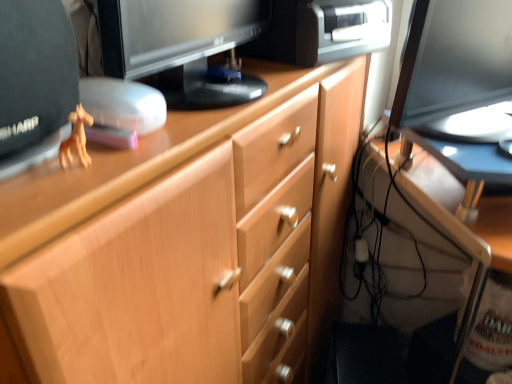
Image resolution: width=512 pixels, height=384 pixels. In order to click on satin black monitor at upper right in this screenshot , I will do `click(453, 59)`.

The height and width of the screenshot is (384, 512). What do you see at coordinates (453, 59) in the screenshot?
I see `satin black monitor at upper right` at bounding box center [453, 59].

The width and height of the screenshot is (512, 384). What are the coordinates of `satin black monitor at upper right` in the screenshot? It's located at (453, 59).